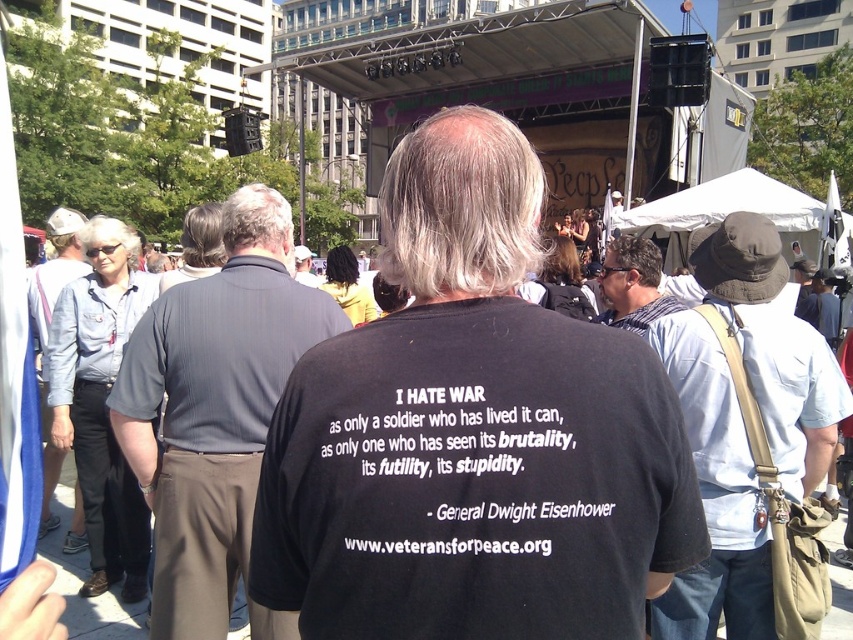
Question: Is blackmaterial/texturet-shirt at center to the right of striped scarf at center from the viewer's perspective?

Choices:
 (A) no
 (B) yes

Answer: (A)

Question: Among these objects, which one is farthest from the camera?

Choices:
 (A) striped scarf at center
 (B) black cotton t-shirt at center
 (C) dark gray shirt at center

Answer: (A)

Question: Which of the following is the farthest from the observer?

Choices:
 (A) blackmaterial/texturet-shirt at center
 (B) striped scarf at center
 (C) black cotton t-shirt at center
 (D) light blue shirt at center

Answer: (B)

Question: Estimate the real-world distances between objects in this image. Which object is closer to the light blue shirt at center?

Choices:
 (A) black cotton t-shirt at center
 (B) striped scarf at center
 (C) dark gray shirt at center
 (D) blackmaterial/texturet-shirt at center

Answer: (B)

Question: Is black cotton t-shirt at center below blackmaterial/texturet-shirt at center?

Choices:
 (A) no
 (B) yes

Answer: (B)

Question: Is light blue shirt at center positioned before blackmaterial/texturet-shirt at center?

Choices:
 (A) no
 (B) yes

Answer: (A)